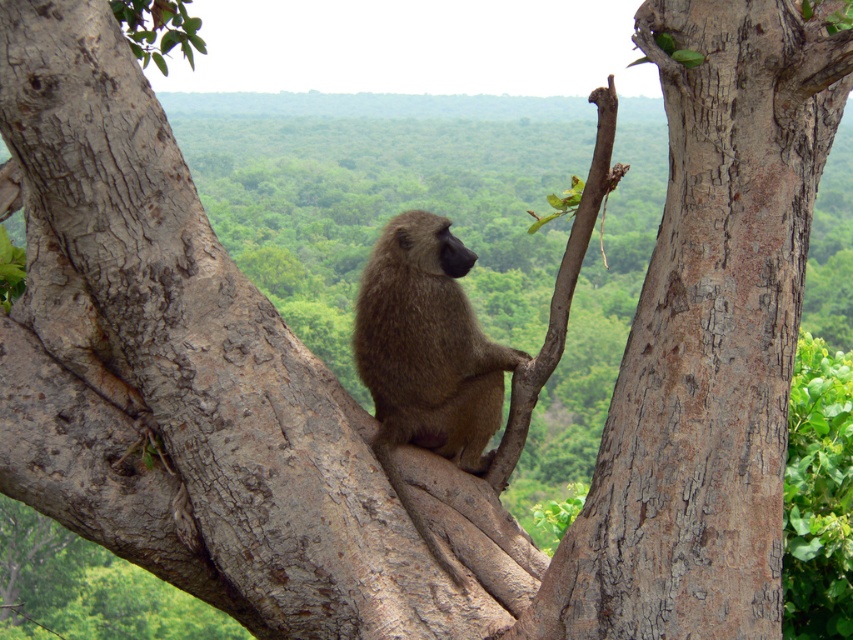
Does gray rough bark tree trunk at center have a greater width compared to fuzzy brown monkey at center?

Indeed, gray rough bark tree trunk at center has a greater width compared to fuzzy brown monkey at center.

Which is in front, point (785, 358) or point (445, 348)?

Point (785, 358) is in front.

Identify the location of gray rough bark tree trunk at center. The width and height of the screenshot is (853, 640). (706, 339).

Where is `gray rough bark tree trunk at center`? The height and width of the screenshot is (640, 853). gray rough bark tree trunk at center is located at coordinates (706, 339).

Is the position of gray rough bark tree trunk at center less distant than that of brown rough bark at upper center?

Yes, gray rough bark tree trunk at center is closer to the viewer.

Between point (767, 161) and point (548, 376), which one is positioned in front?

Point (767, 161) is in front.

The image size is (853, 640). Identify the location of gray rough bark tree trunk at center. (706, 339).

In the scene shown: Which is below, fuzzy brown monkey at center or brown rough bark at upper center?

Positioned lower is fuzzy brown monkey at center.

Which is in front, point (372, 305) or point (587, 236)?

Point (587, 236) is more forward.

Locate an element on the screen. fuzzy brown monkey at center is located at coordinates (427, 346).